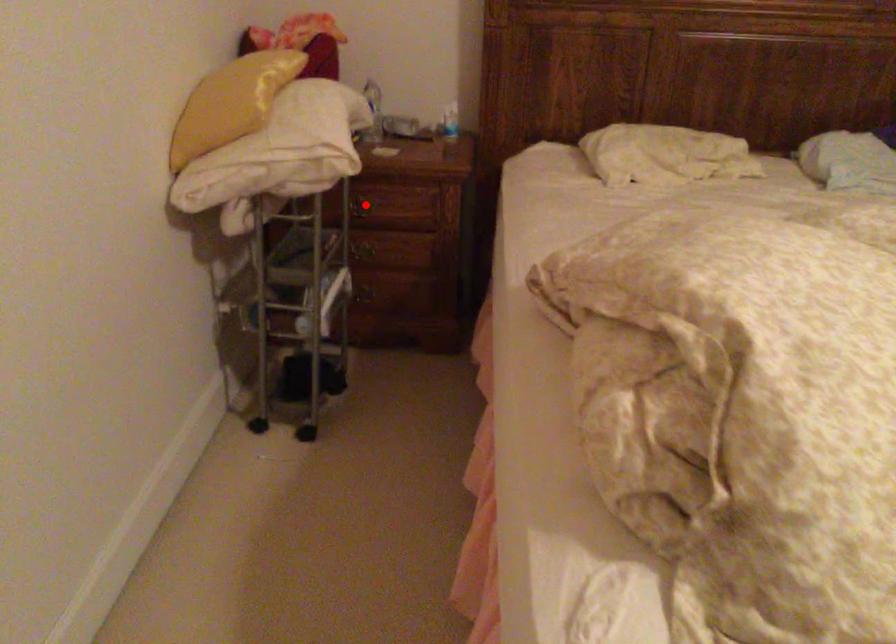
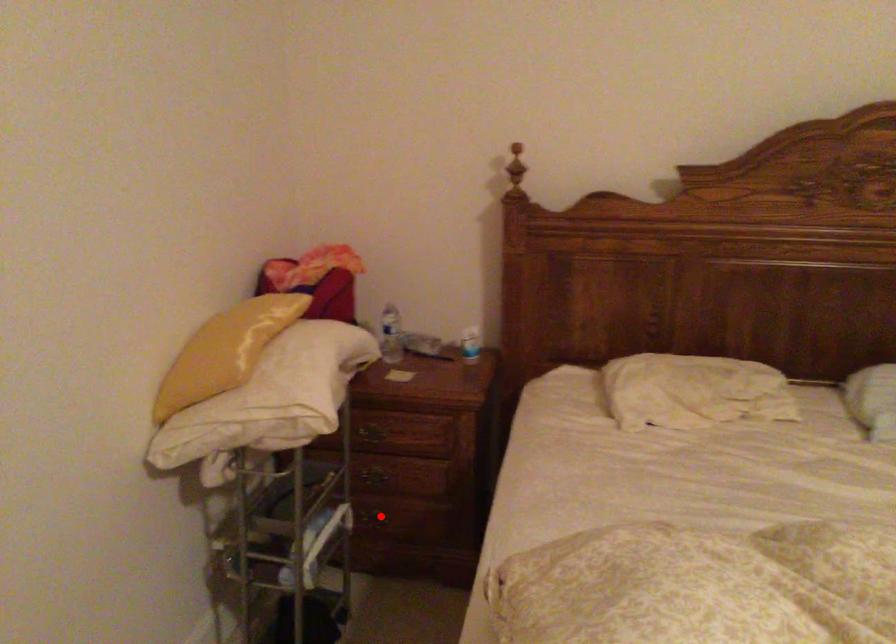
I am providing you with two images of the same scene from different viewpoints. A red point is marked on the first image and another point is marked on the second image. Is the marked point in image1 the same physical position as the marked point in image2?

No